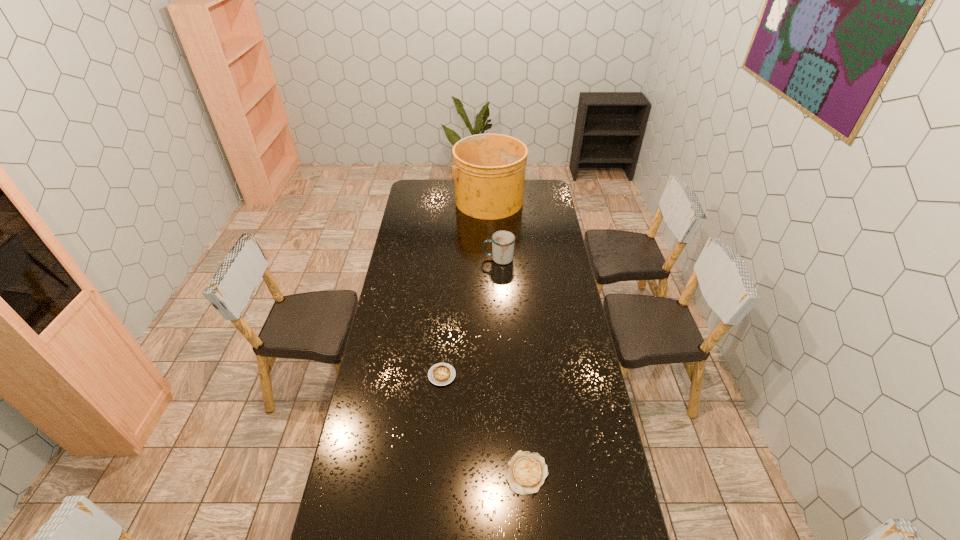
Identify the location of the tallest object. The width and height of the screenshot is (960, 540). (489, 169).

Where is `the farthest object`? This screenshot has width=960, height=540. the farthest object is located at coordinates (489, 169).

Find the location of a particular element. The image size is (960, 540). mug is located at coordinates (503, 242).

Where is `the third nearest object`? Image resolution: width=960 pixels, height=540 pixels. the third nearest object is located at coordinates (503, 242).

Identify the location of the left quiche. (440, 374).

Where is `the farther quiche`? the farther quiche is located at coordinates (440, 374).

In order to click on the nearer quiche in this screenshot , I will do `click(526, 473)`.

You are a GUI agent. You are given a task and a screenshot of the screen. Output one action in this format:
    pyautogui.click(x=<x>, y=<y>)
    Task: Click on the nearest object
    Image resolution: width=960 pixels, height=540 pixels.
    Given the screenshot: What is the action you would take?
    pyautogui.click(x=526, y=473)

This screenshot has height=540, width=960. I want to click on vacant space situated 0.210m on the front of the tallest object, so click(x=489, y=243).

You are a GUI agent. You are given a task and a screenshot of the screen. Output one action in this format:
    pyautogui.click(x=<x>, y=<y>)
    Task: Click on the vacant region located 0.370m on the handle side of the mug
    The height and width of the screenshot is (540, 960).
    Given the screenshot: What is the action you would take?
    pyautogui.click(x=411, y=259)